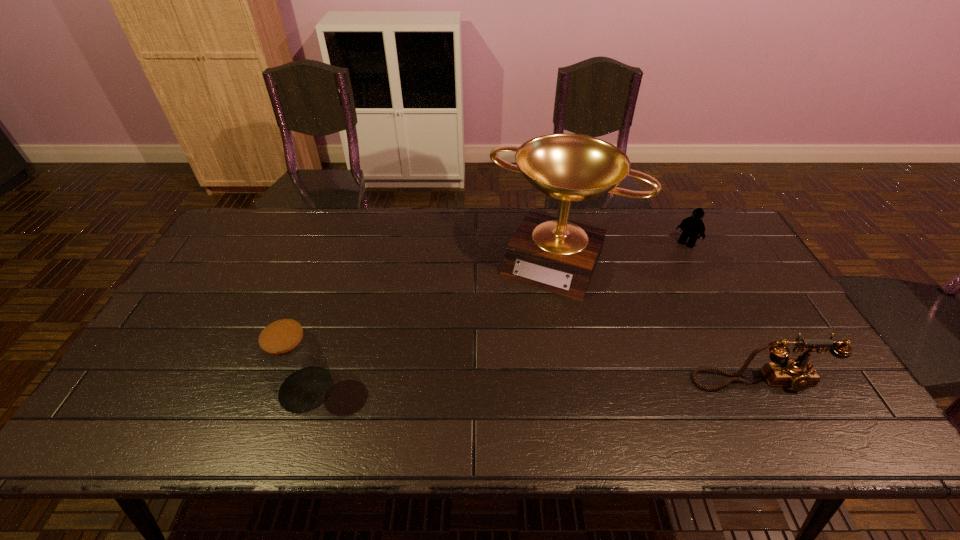
At what (x,y) coordinates should I click in order to perform the action: click on free spot on the desktop that is between the leftmost object and the telephone and is positioned on the face of the Lego. Please return your answer as a coordinate pair (x, y). Looking at the image, I should click on (581, 384).

Identify the location of vacant spot on the desktop that is between the leftmost object and the telephone and is positioned on the front-facing side of the tallest object. 500,386.